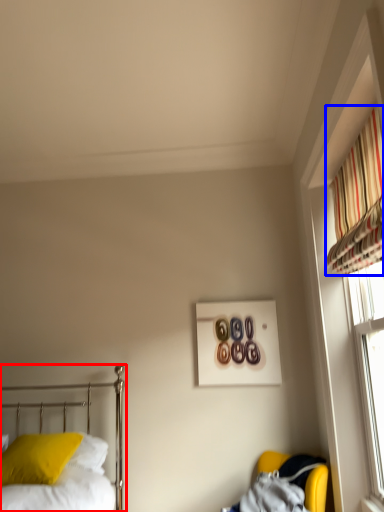
Question: Which object appears closest to the camera in this image, bed (highlighted by a red box) or curtain (highlighted by a blue box)?

Choices:
 (A) bed
 (B) curtain

Answer: (A)